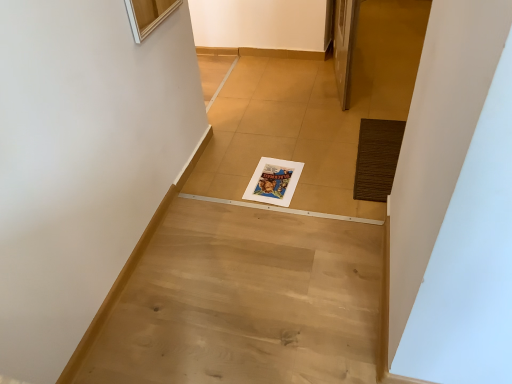
What do you see at coordinates (274, 181) in the screenshot? The width and height of the screenshot is (512, 384). I see `white paper magazine at center` at bounding box center [274, 181].

What do you see at coordinates (377, 158) in the screenshot?
I see `brown textured mat at right` at bounding box center [377, 158].

This screenshot has height=384, width=512. What do you see at coordinates (244, 300) in the screenshot? I see `light wood floor at center` at bounding box center [244, 300].

Where is `white paper magazine at center`? The height and width of the screenshot is (384, 512). white paper magazine at center is located at coordinates point(274,181).

Are brown textured mat at right and light wood floor at center far apart?

No, brown textured mat at right is not far away from light wood floor at center.

From the image's perspective, is brown textured mat at right under light wood floor at center?

No, from the image's perspective, brown textured mat at right is not beneath light wood floor at center.

From a real-world perspective, which is physically above, brown textured mat at right or light wood floor at center?

light wood floor at center is physically above.

From a real-world perspective, who is located lower, brown textured mat at right or white paper magazine at center?

In real-world perspective, white paper magazine at center is lower.

From the image's perspective, which object appears higher, brown textured mat at right or white paper magazine at center?

brown textured mat at right appears higher in the image.

Does point (386, 142) lie behind point (288, 171)?

Yes, it is behind point (288, 171).

From the picture: In the image, is light wood floor at center on the left side or the right side of brown textured mat at right?

From the image, it's evident that light wood floor at center is to the left of brown textured mat at right.

From the picture: Is light wood floor at center spatially inside brown textured mat at right, or outside of it?

light wood floor at center cannot be found inside brown textured mat at right.

You are a GUI agent. You are given a task and a screenshot of the screen. Output one action in this format:
    pyautogui.click(x=<x>, y=<y>)
    Task: Click on the doormat above the light wood floor at center (from the image's perspective)
    This screenshot has width=512, height=384.
    Given the screenshot: What is the action you would take?
    pyautogui.click(x=377, y=158)

Can you see light wood floor at center touching brown textured mat at right?

light wood floor at center and brown textured mat at right are clearly separated.

Is the depth of white paper magazine at center greater than that of brown textured mat at right?

Yes, white paper magazine at center is behind brown textured mat at right.

From a real-world perspective, which object rests below the other?

white paper magazine at center, from a real-world perspective.

How many degrees apart are the facing directions of white paper magazine at center and brown textured mat at right?

175 degrees.

Is white paper magazine at center placed right next to brown textured mat at right?

No, white paper magazine at center is not next to brown textured mat at right.

Can you tell me how much light wood floor at center and white paper magazine at center differ in facing direction?

The facing directions of light wood floor at center and white paper magazine at center are 175 degrees apart.

Measure the distance between light wood floor at center and white paper magazine at center.

light wood floor at center and white paper magazine at center are 17.65 inches apart.

Choose the correct answer: Is light wood floor at center inside white paper magazine at center or outside it?

light wood floor at center is not enclosed by white paper magazine at center.

Between light wood floor at center and white paper magazine at center, which one appears on the right side from the viewer's perspective?

white paper magazine at center is more to the right.

Based on the photo, is light wood floor at center inside white paper magazine at center?

No, light wood floor at center is located outside of white paper magazine at center.

What's the angular difference between white paper magazine at center and light wood floor at center's facing directions?

There is a 175-degree angle between the facing directions of white paper magazine at center and light wood floor at center.

From the image's perspective, who appears lower, white paper magazine at center or light wood floor at center?

light wood floor at center is shown below in the image.

Would you consider white paper magazine at center to be distant from light wood floor at center?

They are positioned close to each other.

This screenshot has height=384, width=512. Identify the location of stairwell below the brown textured mat at right (from the image's perspective). (244, 300).

Find the location of a particular element. doormat above the white paper magazine at center (from the image's perspective) is located at coordinates (377, 158).

Based on their spatial positions, is light wood floor at center or white paper magazine at center further from brown textured mat at right?

light wood floor at center lies further to brown textured mat at right than the other object.

Based on the photo, considering their positions, is white paper magazine at center positioned further to light wood floor at center than brown textured mat at right?

Based on the image, brown textured mat at right appears to be further to light wood floor at center.

Looking at the image, which one is located closer to white paper magazine at center, brown textured mat at right or light wood floor at center?

brown textured mat at right.

When comparing their distances from light wood floor at center, does brown textured mat at right or white paper magazine at center seem closer?

white paper magazine at center lies closer to light wood floor at center than the other object.

From the image, which object appears to be farther from brown textured mat at right, white paper magazine at center or light wood floor at center?

The object further to brown textured mat at right is light wood floor at center.

From the image, which object appears to be nearer to white paper magazine at center, light wood floor at center or brown textured mat at right?

brown textured mat at right.

You are a GUI agent. You are given a task and a screenshot of the screen. Output one action in this format:
    pyautogui.click(x=<x>, y=<y>)
    Task: Click on the doormat located between light wood floor at center and white paper magazine at center in the depth direction
    
    Given the screenshot: What is the action you would take?
    pyautogui.click(x=377, y=158)